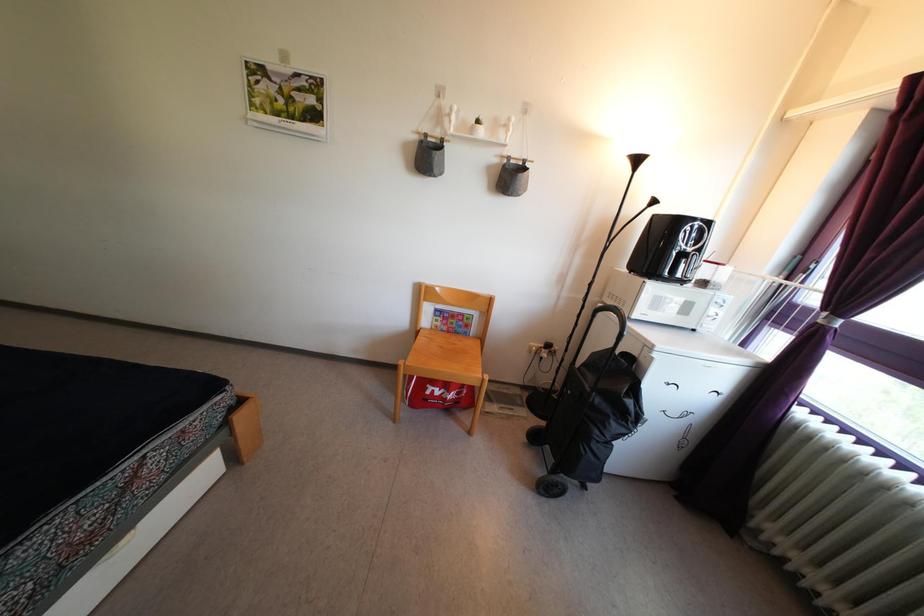
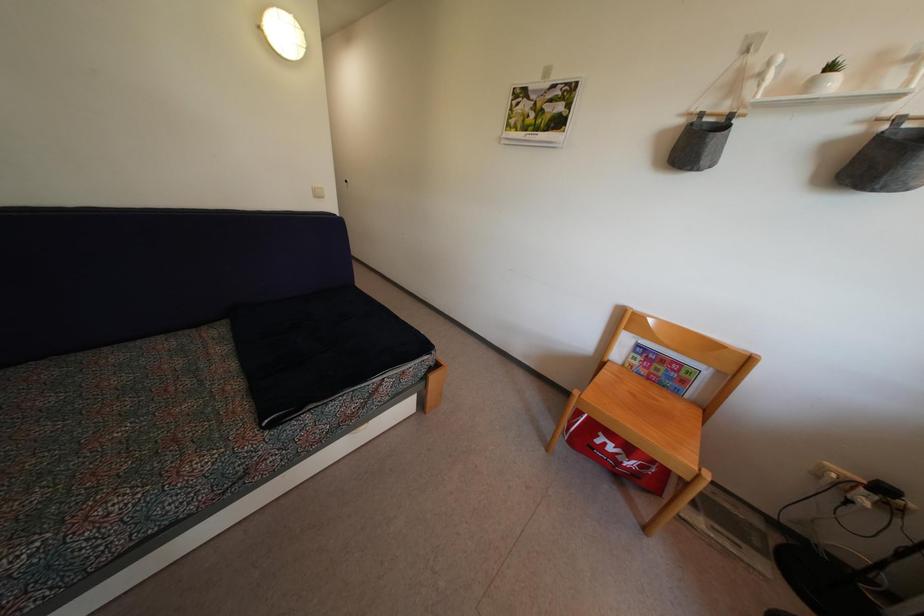
Where in the second image is the point corresponding to pixel 447 337 from the first image?

(647, 381)